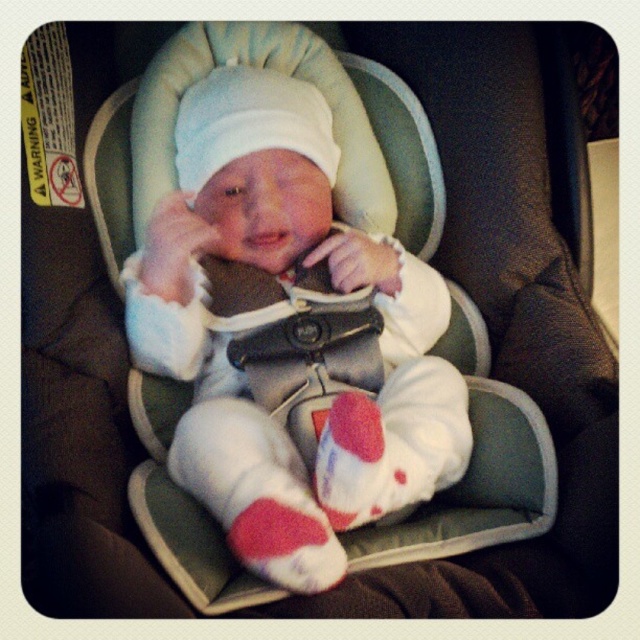
You are a parent preparing to take your baby out in the car. You need to ensure the baby is properly secured in the car seat. Given the white soft baby at center and the red knit sock at lower center, which object is taller and needs to be checked for proper positioning?

The white soft baby at center is much taller than the red knit sock at lower center. Therefore, the parent should ensure the baby is properly secured by adjusting the harness straps to fit snugly around the baby.

You are a parent trying to ensure your baby is comfortable in the car seat. The car seat has a safety harness that needs to be snug but not too tight. Considering the distance between the white soft baby at center and the red knit sock at lower center, can you estimate if the harness is adjusted properly?

The distance between the white soft baby at center and the red knit sock at lower center is 10.02 inches. Since the harness should be snug enough to keep the baby secure without allowing excessive movement, this distance suggests the harness is properly adjusted as the baby isn not too far from the sock, indicating appropriate snugness.